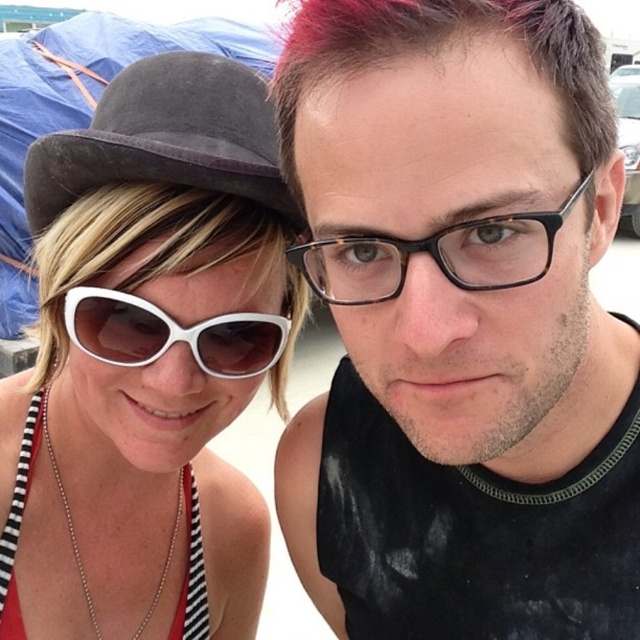
Question: Does matte black tank top at center lie in front of pink dyed hair at upper center?

Choices:
 (A) yes
 (B) no

Answer: (B)

Question: Considering the real-world distances, which object is farthest from the matte black tank top at center?

Choices:
 (A) suede fedora at upper left
 (B) blondehair at left

Answer: (A)

Question: Which of the following is the closest to the observer?

Choices:
 (A) (330, 468)
 (B) (540, 244)

Answer: (B)

Question: Is suede fedora at upper left to the right of pink dyed hair at upper center from the viewer's perspective?

Choices:
 (A) yes
 (B) no

Answer: (B)

Question: Estimate the real-world distances between objects in this image. Which object is closer to the white plastic sunglasses at left?

Choices:
 (A) tortoiseshell frame glasses at center
 (B) white matte hat at upper left

Answer: (B)

Question: Is white matte hat at upper left wider than tortoiseshell frame glasses at center?

Choices:
 (A) yes
 (B) no

Answer: (A)